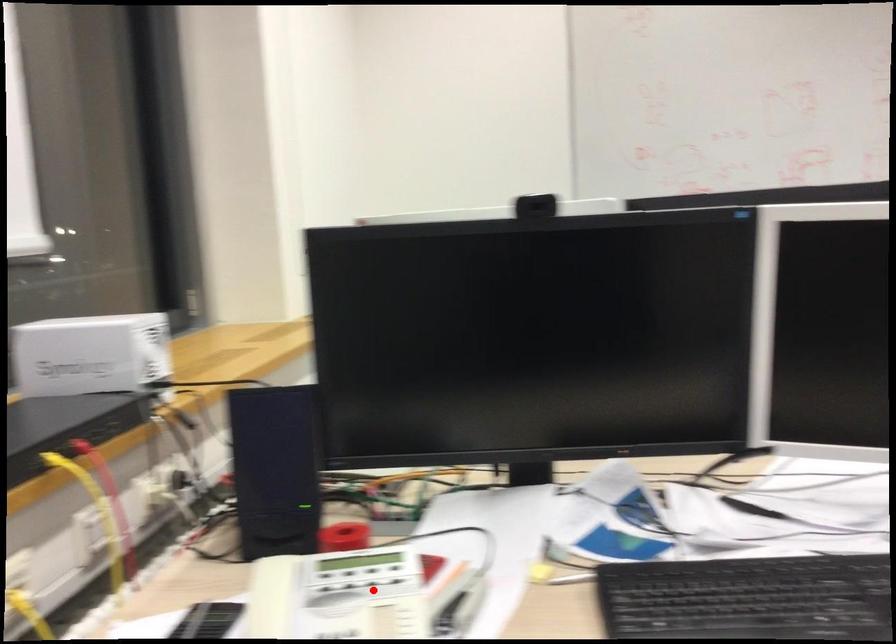
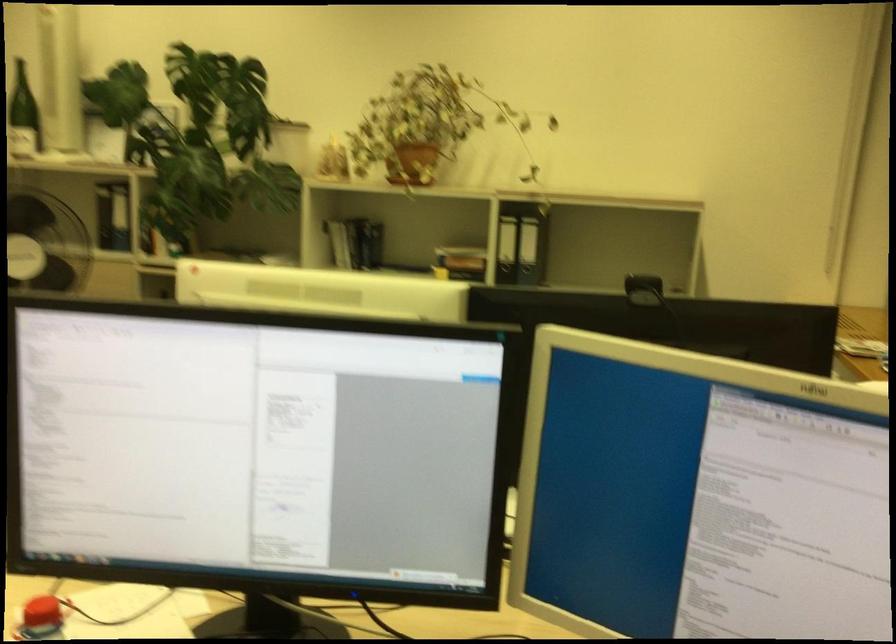
Question: I am providing you with two images of the same scene from different viewpoints. A red point is marked on the first image. At the location where the point appears in image 1, is it still visible in image 2?

Choices:
 (A) Yes
 (B) No

Answer: (B)